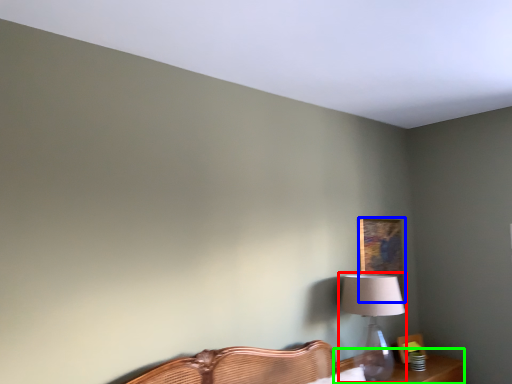
Question: Considering the real-world distances, which object is farthest from table lamp (highlighted by a red box)? picture frame (highlighted by a blue box) or table (highlighted by a green box)?

Choices:
 (A) picture frame
 (B) table

Answer: (A)